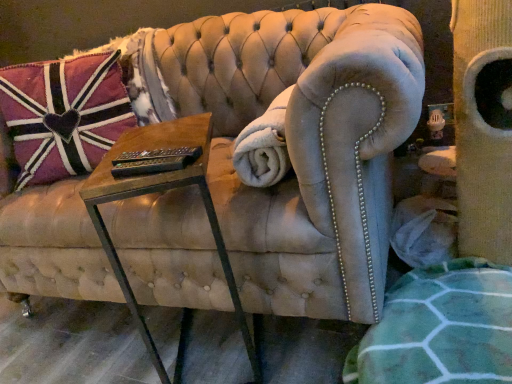
Question: Would you say pink fabric pillow at upper left contains woodenmaterial/texturetable at center?

Choices:
 (A) yes
 (B) no

Answer: (B)

Question: Can you confirm if pink fabric pillow at upper left is shorter than woodenmaterial/texturetable at center?

Choices:
 (A) no
 (B) yes

Answer: (B)

Question: From the image's perspective, is pink fabric pillow at upper left beneath woodenmaterial/texturetable at center?

Choices:
 (A) no
 (B) yes

Answer: (A)

Question: Is pink fabric pillow at upper left smaller than woodenmaterial/texturetable at center?

Choices:
 (A) yes
 (B) no

Answer: (B)

Question: From the image's perspective, would you say pink fabric pillow at upper left is positioned over woodenmaterial/texturetable at center?

Choices:
 (A) no
 (B) yes

Answer: (B)

Question: From the image's perspective, is pink fabric pillow at upper left above or below white fluffy blanket at center?

Choices:
 (A) above
 (B) below

Answer: (A)

Question: In terms of height, does pink fabric pillow at upper left look taller or shorter compared to white fluffy blanket at center?

Choices:
 (A) short
 (B) tall

Answer: (B)

Question: From a real-world perspective, is pink fabric pillow at upper left positioned above or below white fluffy blanket at center?

Choices:
 (A) below
 (B) above

Answer: (B)

Question: Is pink fabric pillow at upper left inside or outside of white fluffy blanket at center?

Choices:
 (A) inside
 (B) outside

Answer: (B)

Question: Is white fluffy blanket at center wider or thinner than pink fabric pillow at upper left?

Choices:
 (A) wide
 (B) thin

Answer: (B)

Question: Do you think white fluffy blanket at center is within pink fabric pillow at upper left, or outside of it?

Choices:
 (A) inside
 (B) outside

Answer: (B)

Question: In terms of height, does white fluffy blanket at center look taller or shorter compared to pink fabric pillow at upper left?

Choices:
 (A) tall
 (B) short

Answer: (B)

Question: From a real-world perspective, relative to pink fabric pillow at upper left, is white fluffy blanket at center vertically above or below?

Choices:
 (A) below
 (B) above

Answer: (A)

Question: Considering the positions of point (206, 190) and point (243, 152), is point (206, 190) closer or farther from the camera than point (243, 152)?

Choices:
 (A) closer
 (B) farther

Answer: (A)

Question: Do you think woodenmaterial/texturetable at center is within white fluffy blanket at center, or outside of it?

Choices:
 (A) inside
 (B) outside

Answer: (B)